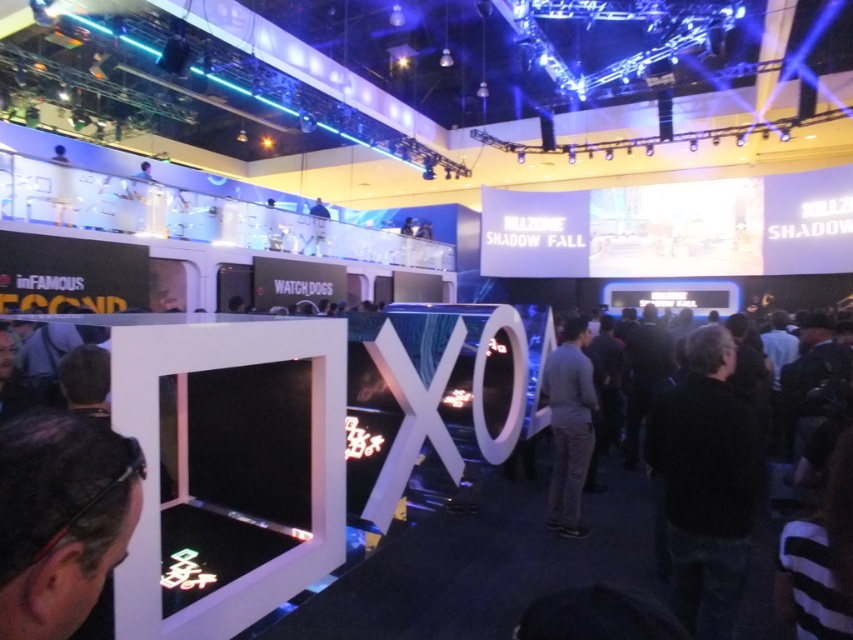
Question: Which object is the farthest from the black matte glasses at lower left?

Choices:
 (A) black shirt at center
 (B) black matte jacket at lower right

Answer: (A)

Question: Which point is farther to the camera?

Choices:
 (A) black matte jacket at lower right
 (B) black shirt at center
 (C) gray fabric shirt at center

Answer: (C)

Question: Which object appears closest to the camera in this image?

Choices:
 (A) black matte jacket at lower right
 (B) black matte glasses at lower left
 (C) black shirt at center
 (D) gray fabric shirt at center

Answer: (B)

Question: Is black shirt at center to the left of gray fabric shirt at center from the viewer's perspective?

Choices:
 (A) yes
 (B) no

Answer: (B)

Question: Does black shirt at center have a lesser width compared to gray fabric shirt at center?

Choices:
 (A) no
 (B) yes

Answer: (A)

Question: In this image, where is black shirt at center located relative to black matte glasses at lower left?

Choices:
 (A) below
 (B) above

Answer: (A)